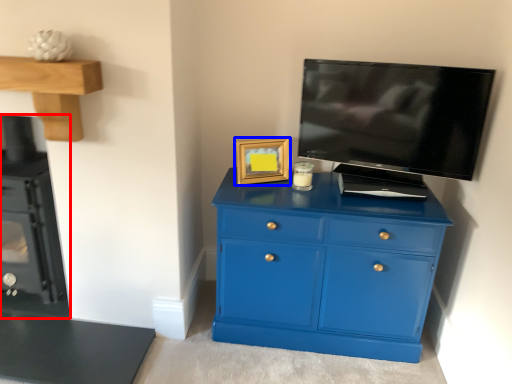
Question: Which object is further to the camera taking this photo, appliance (highlighted by a red box) or picture frame (highlighted by a blue box)?

Choices:
 (A) appliance
 (B) picture frame

Answer: (B)